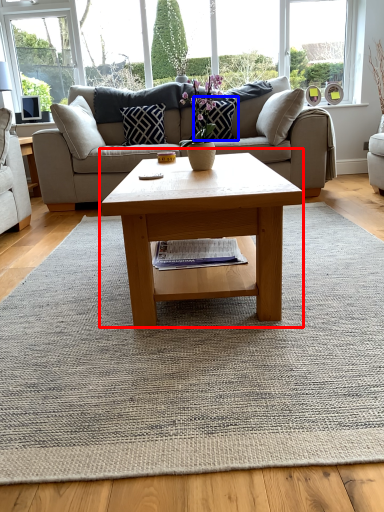
Question: Which object appears farthest to the camera in this image, coffee table (highlighted by a red box) or pillow (highlighted by a blue box)?

Choices:
 (A) coffee table
 (B) pillow

Answer: (B)